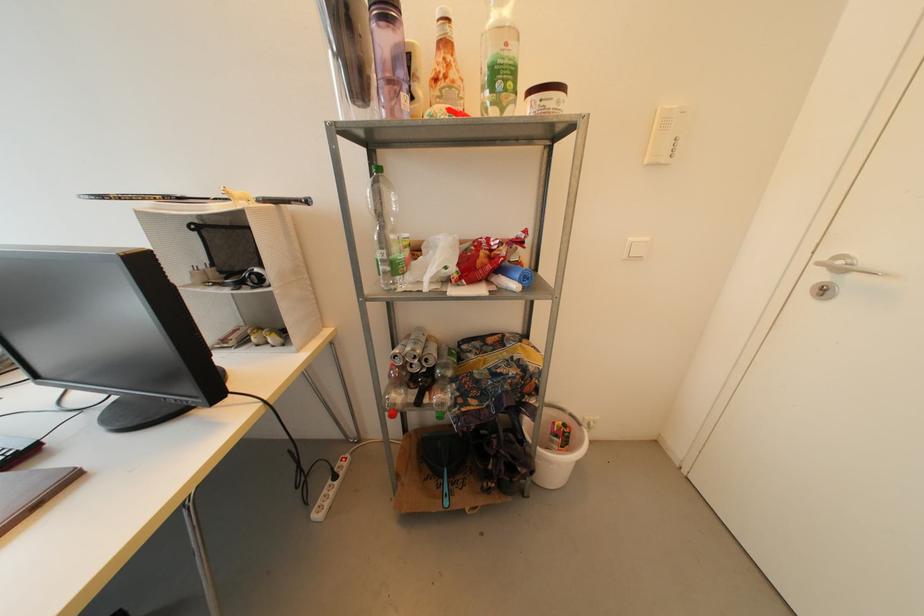
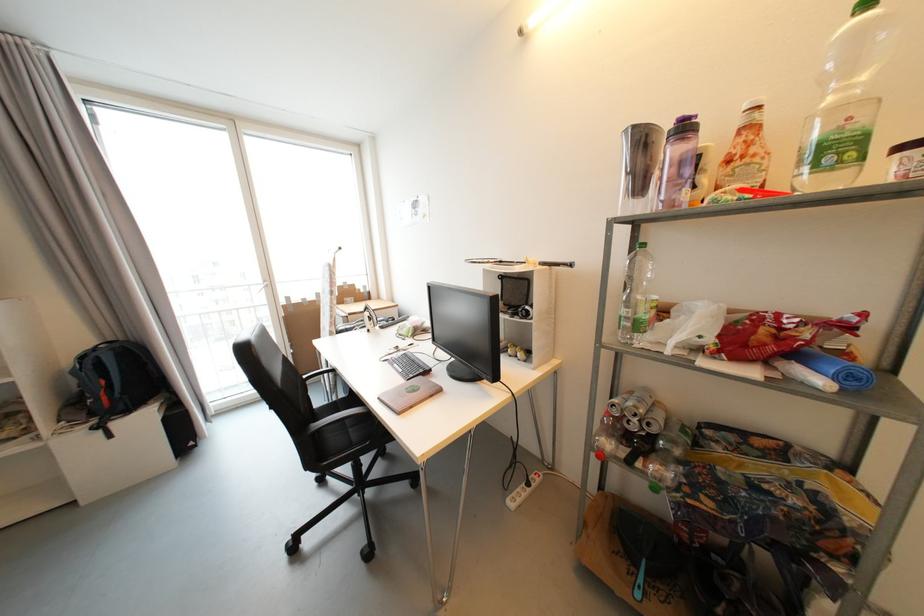
Find the pixel in the second image that matches pixel 186 201 in the first image.

(505, 264)